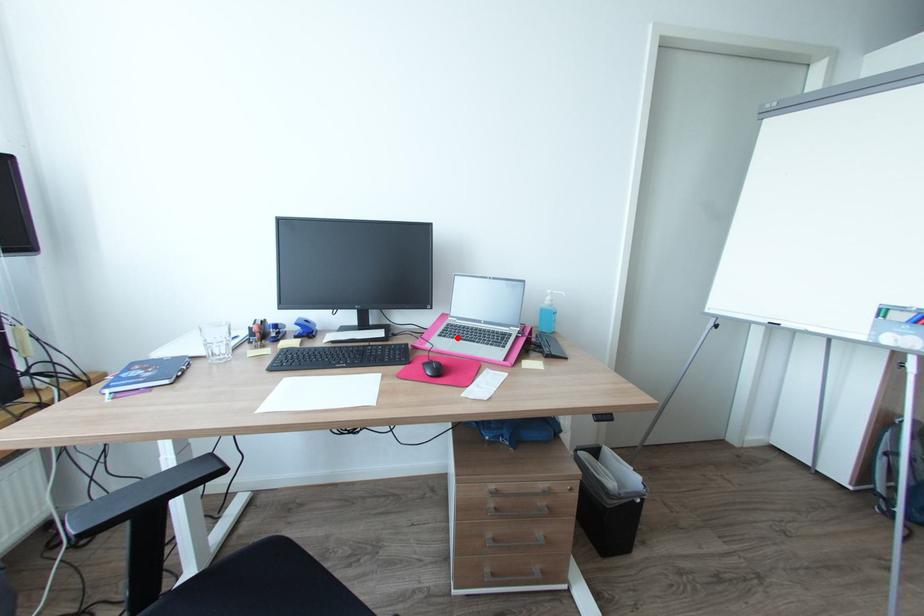
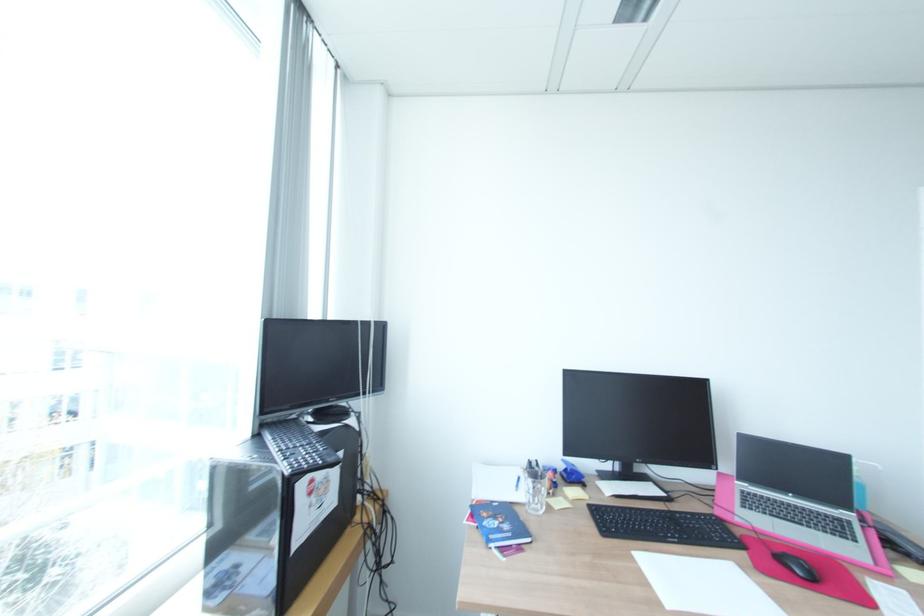
Locate, in the second image, the point that corresponds to the highlighted location in the first image.

(770, 513)